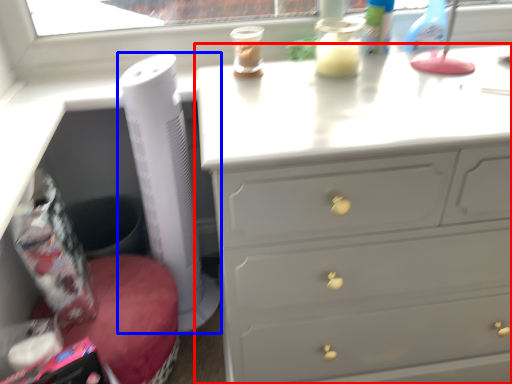
Question: Which of the following is the farthest to the observer, chest of drawers (highlighted by a red box) or appliance (highlighted by a blue box)?

Choices:
 (A) chest of drawers
 (B) appliance

Answer: (B)